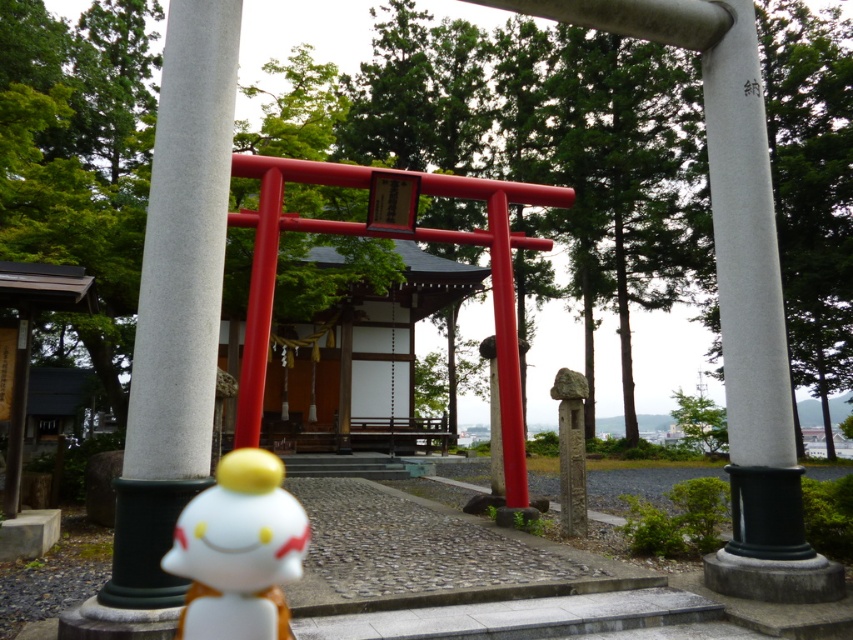
Question: Which of the following is the closest to the observer?

Choices:
 (A) (178, 481)
 (B) (183, 570)

Answer: (B)

Question: Is smooth gray stone pillar at center to the left of white glossy figurine at lower center from the viewer's perspective?

Choices:
 (A) no
 (B) yes

Answer: (B)

Question: Can you confirm if smooth gray stone pillar at center is wider than white glossy figurine at lower center?

Choices:
 (A) yes
 (B) no

Answer: (B)

Question: Which of the following is the farthest from the observer?

Choices:
 (A) click(134, 419)
 (B) click(262, 532)

Answer: (A)

Question: Does smooth gray stone pillar at center have a lesser width compared to white glossy figurine at lower center?

Choices:
 (A) no
 (B) yes

Answer: (B)